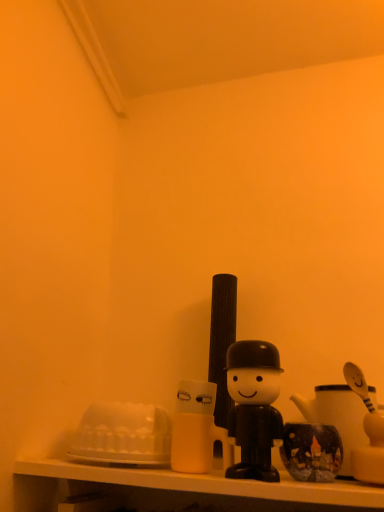
Question: Is white glossy shelf at lower center taller or shorter than black matte toy at center?

Choices:
 (A) short
 (B) tall

Answer: (A)

Question: From a real-world perspective, is white glossy shelf at lower center physically located above or below black matte toy at center?

Choices:
 (A) below
 (B) above

Answer: (A)

Question: In terms of width, does white glossy shelf at lower center look wider or thinner when compared to black matte toy at center?

Choices:
 (A) wide
 (B) thin

Answer: (A)

Question: In the image, is black matte toy at center on the left side or the right side of white glossy shelf at lower center?

Choices:
 (A) right
 (B) left

Answer: (A)

Question: Is black matte toy at center situated inside white glossy shelf at lower center or outside?

Choices:
 (A) inside
 (B) outside

Answer: (B)

Question: From a real-world perspective, relative to white glossy shelf at lower center, is black matte toy at center vertically above or below?

Choices:
 (A) above
 (B) below

Answer: (A)

Question: Considering the positions of black matte toy at center and white glossy shelf at lower center in the image, is black matte toy at center wider or thinner than white glossy shelf at lower center?

Choices:
 (A) wide
 (B) thin

Answer: (B)